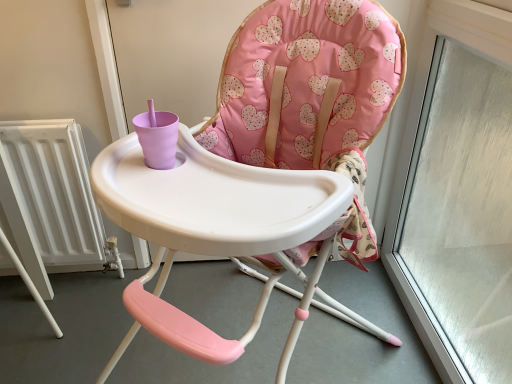
The height and width of the screenshot is (384, 512). Identify the location of unoccupied region to the right of white metallic radiator at left. click(x=122, y=301).